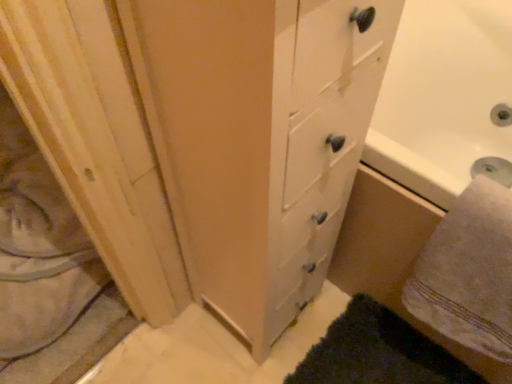
Question: Would you say natural wood screen door at left is part of white soft towel at lower right's contents?

Choices:
 (A) yes
 (B) no

Answer: (B)

Question: Considering the relative sizes of white soft towel at lower right and natural wood screen door at left in the image provided, is white soft towel at lower right thinner than natural wood screen door at left?

Choices:
 (A) no
 (B) yes

Answer: (B)

Question: Does white soft towel at lower right have a larger size compared to natural wood screen door at left?

Choices:
 (A) yes
 (B) no

Answer: (B)

Question: Considering the relative positions of white soft towel at lower right and natural wood screen door at left in the image provided, is white soft towel at lower right to the right of natural wood screen door at left from the viewer's perspective?

Choices:
 (A) no
 (B) yes

Answer: (B)

Question: From the image's perspective, is white soft towel at lower right located beneath natural wood screen door at left?

Choices:
 (A) no
 (B) yes

Answer: (B)

Question: Could you tell me if white soft towel at lower right is turned towards natural wood screen door at left?

Choices:
 (A) no
 (B) yes

Answer: (A)

Question: Considering the relative sizes of natural wood screen door at left and white soft towel at lower right in the image provided, is natural wood screen door at left shorter than white soft towel at lower right?

Choices:
 (A) no
 (B) yes

Answer: (B)

Question: From a real-world perspective, is natural wood screen door at left positioned over white soft towel at lower right based on gravity?

Choices:
 (A) no
 (B) yes

Answer: (A)

Question: Is natural wood screen door at left to the left of white soft towel at lower right from the viewer's perspective?

Choices:
 (A) no
 (B) yes

Answer: (B)

Question: Can you confirm if natural wood screen door at left is wider than white soft towel at lower right?

Choices:
 (A) yes
 (B) no

Answer: (A)

Question: Is natural wood screen door at left not near white soft towel at lower right?

Choices:
 (A) yes
 (B) no

Answer: (B)

Question: Can you confirm if natural wood screen door at left is taller than white soft towel at lower right?

Choices:
 (A) yes
 (B) no

Answer: (B)

Question: Considering the relative positions of natural wood screen door at left and white soft towel at lower right in the image provided, is natural wood screen door at left to the left or to the right of white soft towel at lower right?

Choices:
 (A) left
 (B) right

Answer: (A)